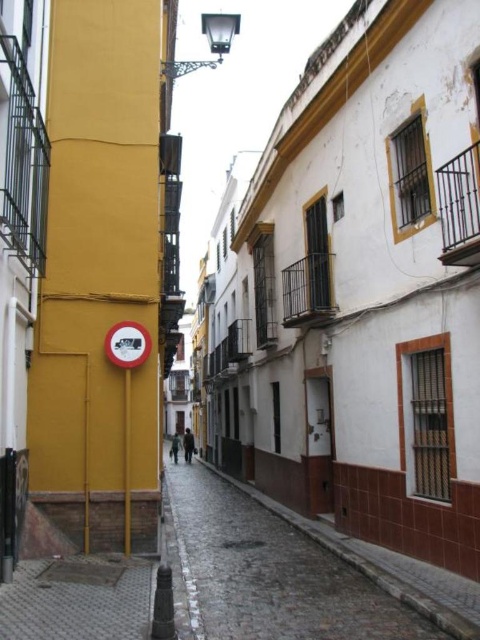
Which is below, cobblestone pavement at center or gray textured pavement at lower left?

Positioned lower is cobblestone pavement at center.

The height and width of the screenshot is (640, 480). Identify the location of cobblestone pavement at center. (296, 573).

Is red plastic circle at center bigger than smooth yellow pole at center?

Actually, red plastic circle at center might be smaller than smooth yellow pole at center.

Consider the image. Who is higher up, red plastic circle at center or smooth yellow pole at center?

red plastic circle at center is above.

Which is in front, point (139, 358) or point (129, 388)?

Point (129, 388) is in front.

The height and width of the screenshot is (640, 480). What are the coordinates of `red plastic circle at center` in the screenshot? It's located at (127, 344).

Is cobblestone pavement at center below red plastic circle at center?

Yes, cobblestone pavement at center is below red plastic circle at center.

Who is positioned more to the left, cobblestone pavement at center or red plastic circle at center?

From the viewer's perspective, red plastic circle at center appears more on the left side.

Is point (167, 518) positioned before point (128, 333)?

No, (167, 518) is further to viewer.

Identify the location of cobblestone pavement at center. click(296, 573).